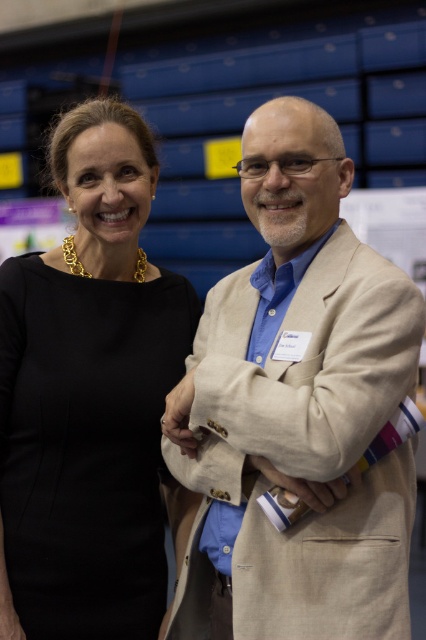
Question: Can you confirm if beige textured blazer at center is positioned below black satin dress at left?

Choices:
 (A) no
 (B) yes

Answer: (B)

Question: Considering the relative positions of beige textured blazer at center and black satin dress at left in the image provided, where is beige textured blazer at center located with respect to black satin dress at left?

Choices:
 (A) left
 (B) right

Answer: (B)

Question: Which point is closer to the camera?

Choices:
 (A) (221, 371)
 (B) (66, 451)

Answer: (A)

Question: Does beige textured blazer at center come behind black satin dress at left?

Choices:
 (A) no
 (B) yes

Answer: (A)

Question: Which point appears closest to the camera in this image?

Choices:
 (A) 137,252
 (B) 397,365

Answer: (B)